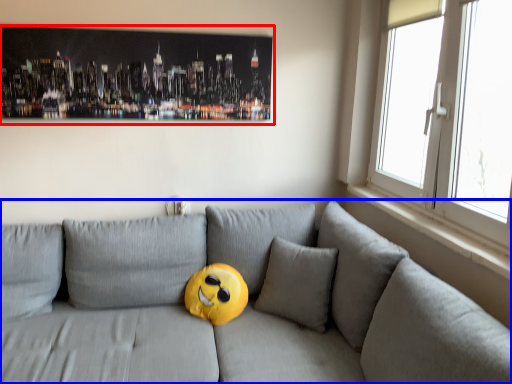
Question: Which of the following is the closest to the observer, picture frame (highlighted by a red box) or studio couch (highlighted by a blue box)?

Choices:
 (A) picture frame
 (B) studio couch

Answer: (B)